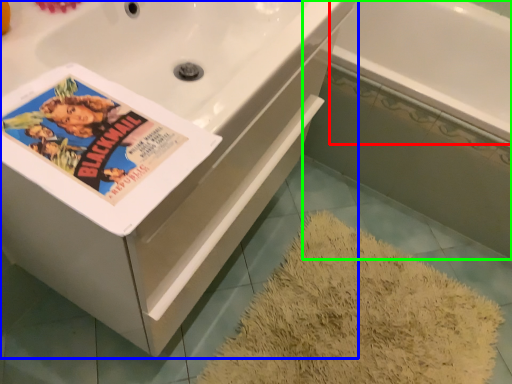
Question: Which object is positioned farthest from bath (highlighted by a red box)? Select from bathtub (highlighted by a blue box) and bath (highlighted by a green box).

Choices:
 (A) bathtub
 (B) bath

Answer: (A)